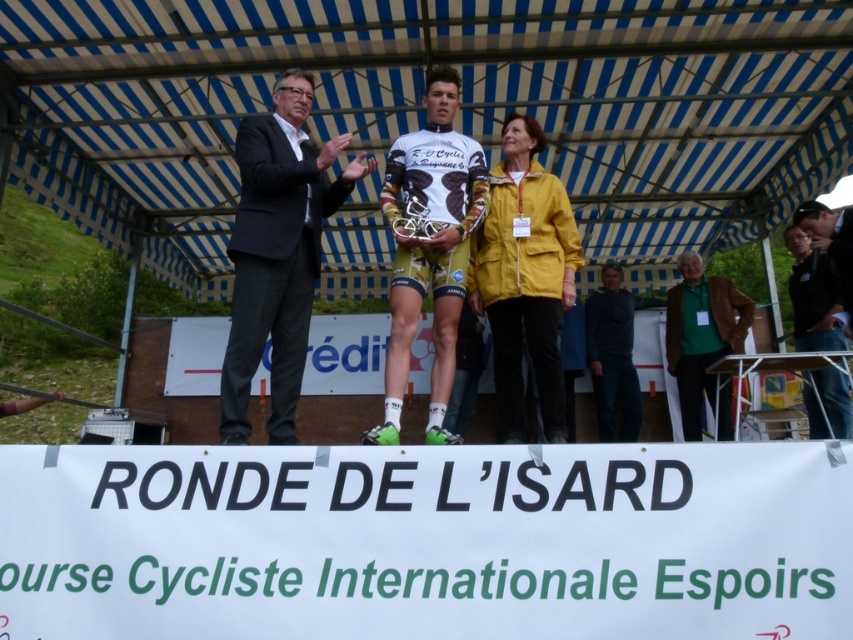
Based on the photo, which is below, yellow fabric jacket at center or black fabric jacket at lower right?

black fabric jacket at lower right

Who is more distant from viewer, [505,124] or [844,403]?

The point [844,403] is more distant.

Identify the location of yellow fabric jacket at center. (524, 276).

Is yellow fabric jacket at center bigger than green fabric shirt at lower right?

No.

Is yellow fabric jacket at center further to camera compared to green fabric shirt at lower right?

No, yellow fabric jacket at center is in front of green fabric shirt at lower right.

The image size is (853, 640). Identify the location of yellow fabric jacket at center. (524, 276).

What do you see at coordinates (524, 276) in the screenshot? The image size is (853, 640). I see `yellow fabric jacket at center` at bounding box center [524, 276].

Find the location of a particular element. yellow fabric jacket at center is located at coordinates coord(524,276).